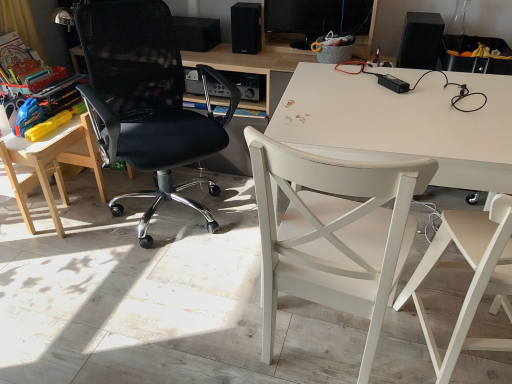
You are a GUI agent. You are given a task and a screenshot of the screen. Output one action in this format:
    pyautogui.click(x=<x>, y=<y>)
    Task: Click on the vacant space underneath white wood chair at center, the 3th chair viewed from the left (from a real-world perspective)
    Image resolution: width=512 pixels, height=384 pixels.
    Given the screenshot: What is the action you would take?
    pyautogui.click(x=317, y=341)